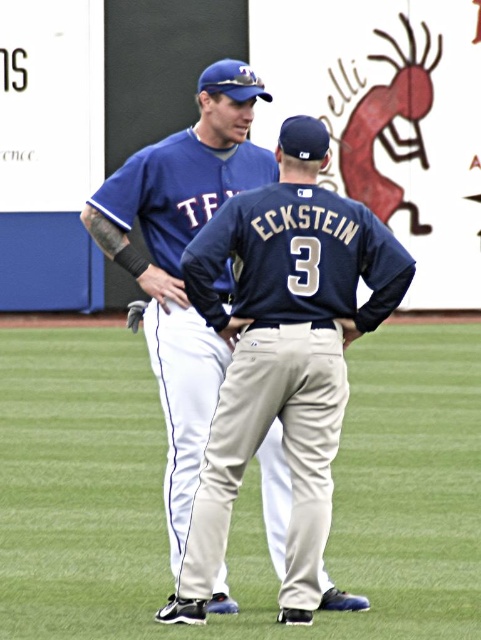
In the scene shown: You are a photographer positioned at the edge of the baseball field. You need to capture a photo where both the dark blue jersey at center and the brown leather glove at center are clearly visible. Considering their sizes, which object should you focus on first to ensure both are in frame?

The dark blue jersey at center is taller than the brown leather glove at center, so you should focus on the dark blue jersey at center first to ensure both are in frame.

From the picture: You are a photographer positioned at the edge of the baseball field. You need to capture a photo where both the white fabric pants at center and the brown leather glove at center are clearly visible. Based on their positions, which object will appear larger in the photo?

The white fabric pants at center will appear larger in the photo because it is taller than the brown leather glove at center.